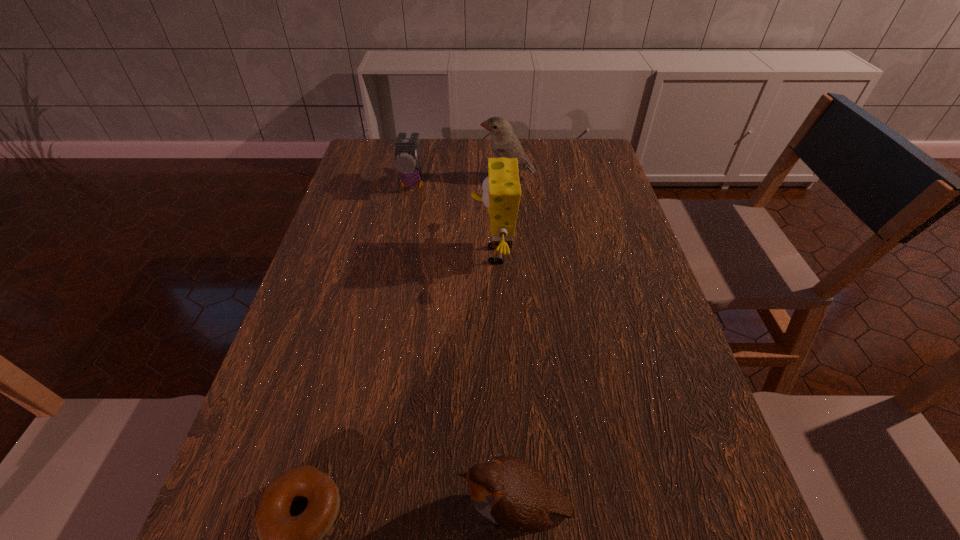
Identify the location of sponge. The height and width of the screenshot is (540, 960). pos(501,189).

Locate an element on the screen. the third nearest object is located at coordinates (501, 189).

The width and height of the screenshot is (960, 540). What are the coordinates of `the fourth shortest object` in the screenshot? It's located at (504, 143).

Where is `the leftmost bird`? The height and width of the screenshot is (540, 960). the leftmost bird is located at coordinates (406, 161).

The width and height of the screenshot is (960, 540). Find the location of `free space located on the front-facing side of the tallest object`. free space located on the front-facing side of the tallest object is located at coordinates (365, 255).

The height and width of the screenshot is (540, 960). I want to click on vacant space located 0.120m on the front-facing side of the tallest object, so click(426, 255).

Identify the location of vacant space situated on the front-facing side of the tallest object. This screenshot has height=540, width=960. [361, 255].

At what (x,y) coordinates should I click in order to perform the action: click on vacant region located at the face of the tallest bird. Please return your answer as a coordinate pair (x, y). The image size is (960, 540). Looking at the image, I should click on (365, 179).

The height and width of the screenshot is (540, 960). Find the location of `vacant space situated at the face of the tallest bird`. vacant space situated at the face of the tallest bird is located at coordinates (445, 179).

Identify the location of free region located 0.260m at the face of the tallest bird. (398, 179).